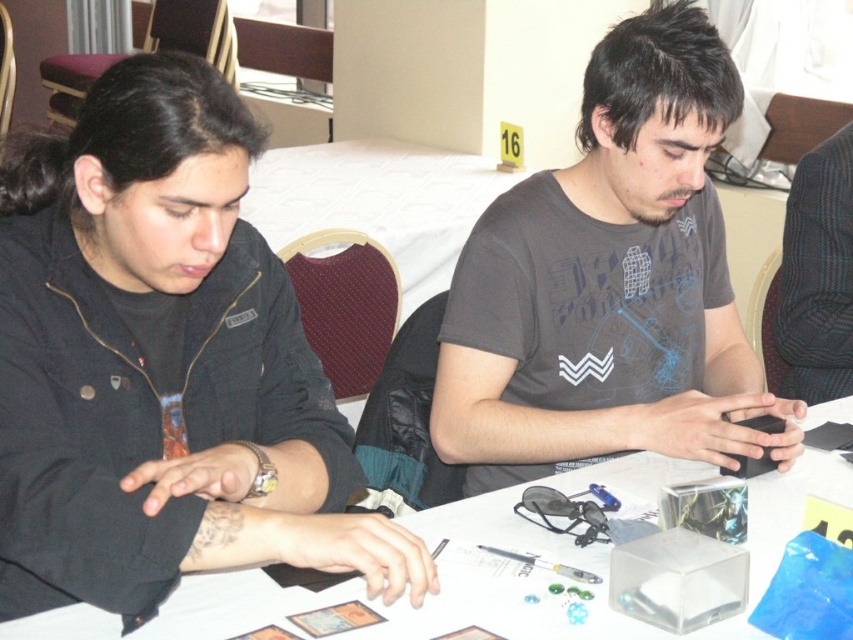
Is black matte jacket at upper left smaller than matte gray t-shirt at center?

Yes, black matte jacket at upper left is smaller than matte gray t-shirt at center.

Can you confirm if black matte jacket at upper left is positioned above matte gray t-shirt at center?

Incorrect, black matte jacket at upper left is not positioned above matte gray t-shirt at center.

Describe the element at coordinates (161, 365) in the screenshot. This screenshot has height=640, width=853. I see `black matte jacket at upper left` at that location.

Where is `black matte jacket at upper left`? The image size is (853, 640). black matte jacket at upper left is located at coordinates (161, 365).

Identify the location of matte gray t-shirt at center. The image size is (853, 640). (608, 284).

Between matte gray t-shirt at center and white paper at center, which one is positioned lower?

white paper at center

Who is more distant from viewer, (553, 220) or (589, 564)?

The point (553, 220) is more distant.

This screenshot has width=853, height=640. Identify the location of matte gray t-shirt at center. (608, 284).

Can you confirm if black matte jacket at upper left is positioned above white paper at center?

Yes, black matte jacket at upper left is above white paper at center.

What do you see at coordinates (161, 365) in the screenshot? This screenshot has height=640, width=853. I see `black matte jacket at upper left` at bounding box center [161, 365].

What are the coordinates of `black matte jacket at upper left` in the screenshot? It's located at (161, 365).